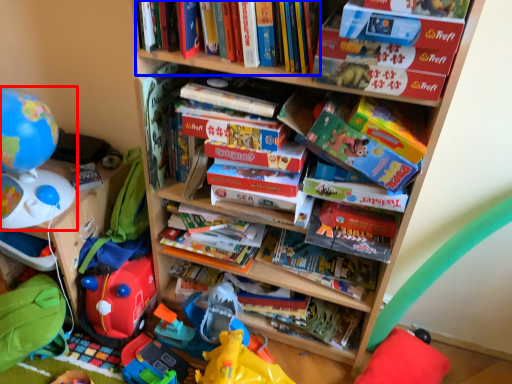
Question: Which point is closer to the camera, toy (highlighted by a red box) or book (highlighted by a blue box)?

Choices:
 (A) toy
 (B) book

Answer: (B)